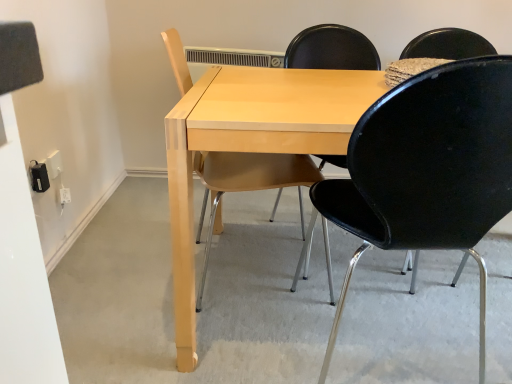
This screenshot has width=512, height=384. Find the location of `empty space that is to the right of light wood chair at center, the 2th chair positioned from the right`. empty space that is to the right of light wood chair at center, the 2th chair positioned from the right is located at coordinates (325, 272).